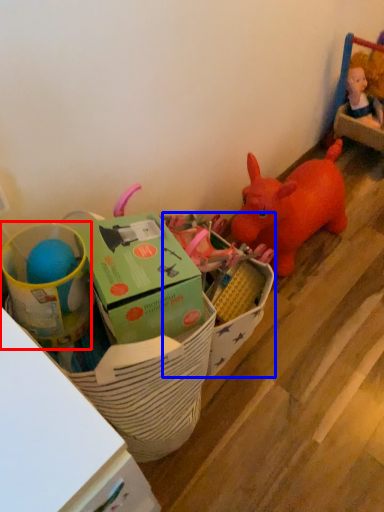
Question: Among these objects, which one is nearest to the camera, toy (highlighted by a red box) or storage box (highlighted by a blue box)?

Choices:
 (A) toy
 (B) storage box

Answer: (A)